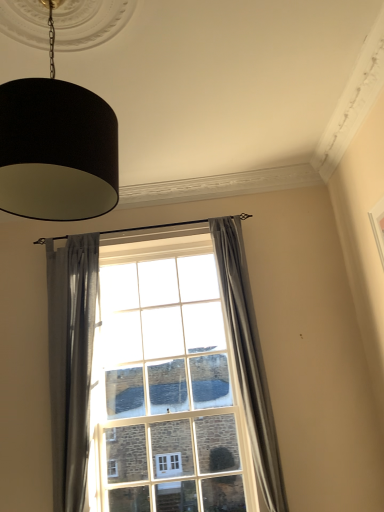
What do you see at coordinates (249, 359) in the screenshot?
I see `gray fabric curtain at center, placed as the second curtain when sorted from left to right` at bounding box center [249, 359].

You are a GUI agent. You are given a task and a screenshot of the screen. Output one action in this format:
    pyautogui.click(x=<x>, y=<y>)
    Task: Click on the satin gray curtain at left, which is the second curtain in right-to-left order
    The image size is (384, 512).
    Given the screenshot: What is the action you would take?
    pyautogui.click(x=71, y=362)

Where is `black fabric lampshade at upper left`? black fabric lampshade at upper left is located at coordinates (56, 148).

Who is more distant, satin gray curtain at left, which is the second curtain in right-to-left order, or clear glass window at center?

clear glass window at center is further from the camera.

From the image's perspective, which is below, satin gray curtain at left, which is the second curtain in right-to-left order, or clear glass window at center?

clear glass window at center appears lower in the image.

Consider the image. Which object is positioned more to the right, satin gray curtain at left, which is counted as the 1th curtain, starting from the left, or clear glass window at center?

From the viewer's perspective, clear glass window at center appears more on the right side.

How much distance is there between satin gray curtain at left, which is counted as the 1th curtain, starting from the left, and clear glass window at center?

satin gray curtain at left, which is counted as the 1th curtain, starting from the left, and clear glass window at center are 11.37 inches apart from each other.

Does point (51, 375) come farther from viewer compared to point (248, 381)?

Yes, point (51, 375) is farther from viewer.

How distant is satin gray curtain at left, which is the second curtain in right-to-left order, from gray fabric curtain at center, which is the first curtain in right-to-left order?

The distance of satin gray curtain at left, which is the second curtain in right-to-left order, from gray fabric curtain at center, which is the first curtain in right-to-left order, is 1.04 meters.

From the image's perspective, which is above, satin gray curtain at left, which is counted as the 1th curtain, starting from the left, or gray fabric curtain at center, which is the first curtain in right-to-left order?

gray fabric curtain at center, which is the first curtain in right-to-left order, appears higher in the image.

How many degrees apart are the facing directions of satin gray curtain at left, which is the second curtain in right-to-left order, and gray fabric curtain at center, placed as the second curtain when sorted from left to right?

The angular difference between satin gray curtain at left, which is the second curtain in right-to-left order, and gray fabric curtain at center, placed as the second curtain when sorted from left to right, is 3.35e-05 degrees.

Can you confirm if black fabric lampshade at upper left is positioned to the right of clear glass window at center?

No, black fabric lampshade at upper left is not to the right of clear glass window at center.

Is point (37, 182) behind point (158, 389)?

No, (37, 182) is in front of (158, 389).

Which object is wider, black fabric lampshade at upper left or clear glass window at center?

black fabric lampshade at upper left.

From the image's perspective, relative to clear glass window at center, is black fabric lampshade at upper left above or below?

Clearly, from the image's perspective, black fabric lampshade at upper left is above clear glass window at center.

From the image's perspective, is clear glass window at center located above or below satin gray curtain at left, which is counted as the 1th curtain, starting from the left?

clear glass window at center is situated lower than satin gray curtain at left, which is counted as the 1th curtain, starting from the left, in the image.

Is clear glass window at center surrounding satin gray curtain at left, which is the second curtain in right-to-left order?

No.

Which object is closer to the camera, clear glass window at center or satin gray curtain at left, which is counted as the 1th curtain, starting from the left?

satin gray curtain at left, which is counted as the 1th curtain, starting from the left.

Can you confirm if clear glass window at center is bigger than satin gray curtain at left, which is counted as the 1th curtain, starting from the left?

Yes.

Is gray fabric curtain at center, which is the first curtain in right-to-left order, surrounding satin gray curtain at left, which is counted as the 1th curtain, starting from the left?

No, satin gray curtain at left, which is counted as the 1th curtain, starting from the left, is not a part of gray fabric curtain at center, which is the first curtain in right-to-left order.

Considering the positions of objects gray fabric curtain at center, placed as the second curtain when sorted from left to right, and satin gray curtain at left, which is counted as the 1th curtain, starting from the left, in the image provided, who is more to the left, gray fabric curtain at center, placed as the second curtain when sorted from left to right, or satin gray curtain at left, which is counted as the 1th curtain, starting from the left,?

Positioned to the left is satin gray curtain at left, which is counted as the 1th curtain, starting from the left.

From a real-world perspective, is gray fabric curtain at center, placed as the second curtain when sorted from left to right, located higher than satin gray curtain at left, which is counted as the 1th curtain, starting from the left?

No, from a real-world perspective, gray fabric curtain at center, placed as the second curtain when sorted from left to right, is not over satin gray curtain at left, which is counted as the 1th curtain, starting from the left

Is gray fabric curtain at center, which is the first curtain in right-to-left order, shorter than satin gray curtain at left, which is the second curtain in right-to-left order?

No, gray fabric curtain at center, which is the first curtain in right-to-left order, is not shorter than satin gray curtain at left, which is the second curtain in right-to-left order.

Which is more to the right, gray fabric curtain at center, which is the first curtain in right-to-left order, or clear glass window at center?

gray fabric curtain at center, which is the first curtain in right-to-left order, is more to the right.

From the picture: Can you see gray fabric curtain at center, placed as the second curtain when sorted from left to right, touching clear glass window at center?

gray fabric curtain at center, placed as the second curtain when sorted from left to right, is not next to clear glass window at center, and they're not touching.

In the image, is gray fabric curtain at center, which is the first curtain in right-to-left order, positioned in front of or behind clear glass window at center?

gray fabric curtain at center, which is the first curtain in right-to-left order, is positioned closer to the viewer than clear glass window at center.

Considering the sizes of objects gray fabric curtain at center, placed as the second curtain when sorted from left to right, and clear glass window at center in the image provided, who is thinner, gray fabric curtain at center, placed as the second curtain when sorted from left to right, or clear glass window at center?

With smaller width is clear glass window at center.

From a real-world perspective, is gray fabric curtain at center, placed as the second curtain when sorted from left to right, physically located above or below black fabric lampshade at upper left?

gray fabric curtain at center, placed as the second curtain when sorted from left to right, is below black fabric lampshade at upper left.

Is gray fabric curtain at center, placed as the second curtain when sorted from left to right, directly adjacent to black fabric lampshade at upper left?

No, gray fabric curtain at center, placed as the second curtain when sorted from left to right, is not with black fabric lampshade at upper left.

Is the position of gray fabric curtain at center, which is the first curtain in right-to-left order, less distant than that of black fabric lampshade at upper left?

No, it is behind black fabric lampshade at upper left.

Between point (228, 231) and point (71, 167), which one is positioned in front?

The point (71, 167) is closer to the camera.

Locate an element on the screen. the 1st curtain positioned above the clear glass window at center (from the image's perspective) is located at coordinates (71, 362).

At what (x,y) coordinates should I click in order to perform the action: click on curtain that is behind the gray fabric curtain at center, placed as the second curtain when sorted from left to right. Please return your answer as a coordinate pair (x, y). The image size is (384, 512). Looking at the image, I should click on (71, 362).

Which object lies nearer to the anchor point clear glass window at center, satin gray curtain at left, which is counted as the 1th curtain, starting from the left, or black fabric lampshade at upper left?

The object closer to clear glass window at center is satin gray curtain at left, which is counted as the 1th curtain, starting from the left.

Based on their spatial positions, is satin gray curtain at left, which is the second curtain in right-to-left order, or black fabric lampshade at upper left further from gray fabric curtain at center, which is the first curtain in right-to-left order?

black fabric lampshade at upper left is further to gray fabric curtain at center, which is the first curtain in right-to-left order.

From the image, which object appears to be nearer to satin gray curtain at left, which is the second curtain in right-to-left order, gray fabric curtain at center, which is the first curtain in right-to-left order, or black fabric lampshade at upper left?

gray fabric curtain at center, which is the first curtain in right-to-left order.

Based on their spatial positions, is black fabric lampshade at upper left or gray fabric curtain at center, placed as the second curtain when sorted from left to right, further from satin gray curtain at left, which is counted as the 1th curtain, starting from the left?

black fabric lampshade at upper left is further to satin gray curtain at left, which is counted as the 1th curtain, starting from the left.

Which object lies further to the anchor point black fabric lampshade at upper left, clear glass window at center or gray fabric curtain at center, which is the first curtain in right-to-left order?

Based on the image, clear glass window at center appears to be further to black fabric lampshade at upper left.

Estimate the real-world distances between objects in this image. Which object is closer to gray fabric curtain at center, placed as the second curtain when sorted from left to right, black fabric lampshade at upper left or clear glass window at center?

The object closer to gray fabric curtain at center, placed as the second curtain when sorted from left to right, is clear glass window at center.

In the scene shown: Estimate the real-world distances between objects in this image. Which object is further from satin gray curtain at left, which is counted as the 1th curtain, starting from the left, clear glass window at center or gray fabric curtain at center, placed as the second curtain when sorted from left to right?

gray fabric curtain at center, placed as the second curtain when sorted from left to right, lies further to satin gray curtain at left, which is counted as the 1th curtain, starting from the left, than the other object.

Which object lies nearer to the anchor point clear glass window at center, black fabric lampshade at upper left or satin gray curtain at left, which is the second curtain in right-to-left order?

satin gray curtain at left, which is the second curtain in right-to-left order, is positioned closer to the anchor clear glass window at center.

Where is `curtain positioned between black fabric lampshade at upper left and satin gray curtain at left, which is the second curtain in right-to-left order, from near to far`? The image size is (384, 512). curtain positioned between black fabric lampshade at upper left and satin gray curtain at left, which is the second curtain in right-to-left order, from near to far is located at coordinates (249, 359).

At what (x,y) coordinates should I click in order to perform the action: click on window between satin gray curtain at left, which is the second curtain in right-to-left order, and gray fabric curtain at center, placed as the second curtain when sorted from left to right. Please return your answer as a coordinate pair (x, y). Image resolution: width=384 pixels, height=512 pixels. Looking at the image, I should click on (157, 375).